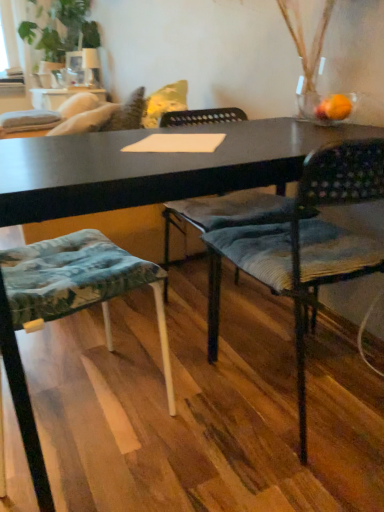
Question: Is green leafy plant at upper left bigger or smaller than textured fabric cushion at lower left, which is the 1th chair from left to right?

Choices:
 (A) big
 (B) small

Answer: (A)

Question: Is green leafy plant at upper left taller or shorter than textured fabric cushion at lower left, the 2th chair viewed from the right?

Choices:
 (A) tall
 (B) short

Answer: (A)

Question: Which is nearer to the green leafy plant at upper left?

Choices:
 (A) textured fabric cushion at lower left, the 2th chair viewed from the right
 (B) textured fabric chair at center, the 2th chair positioned from the left

Answer: (A)

Question: Considering the real-world distances, which object is farthest from the textured fabric chair at center, placed as the first chair when sorted from right to left?

Choices:
 (A) textured fabric cushion at lower left, which is the 1th chair from left to right
 (B) green leafy plant at upper left

Answer: (B)